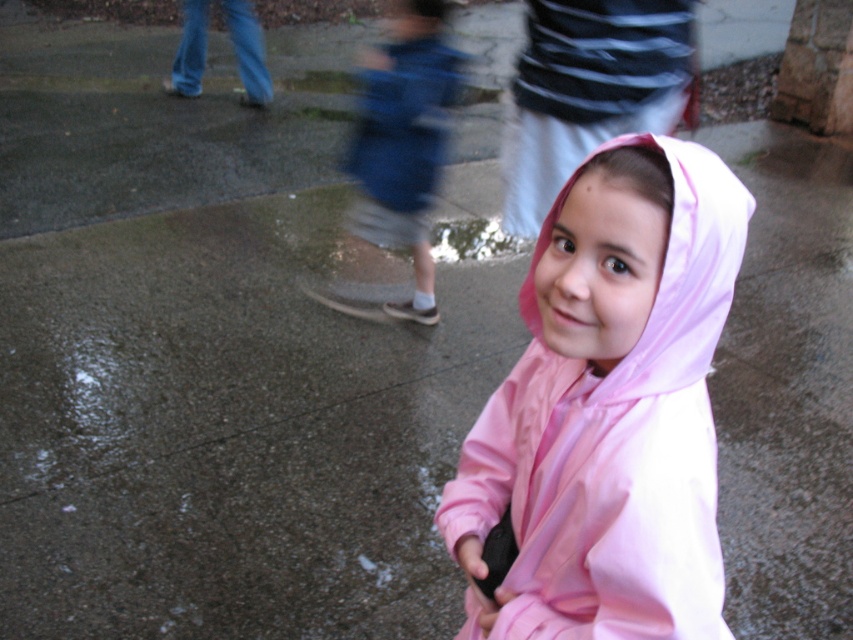
Does pink matte raincoat at center have a lesser height compared to blue denim shorts at center?

Correct, pink matte raincoat at center is not as tall as blue denim shorts at center.

Who is positioned more to the right, pink matte raincoat at center or blue denim shorts at center?

From the viewer's perspective, pink matte raincoat at center appears more on the right side.

The width and height of the screenshot is (853, 640). Describe the element at coordinates (608, 408) in the screenshot. I see `pink matte raincoat at center` at that location.

The height and width of the screenshot is (640, 853). I want to click on pink matte raincoat at center, so click(x=608, y=408).